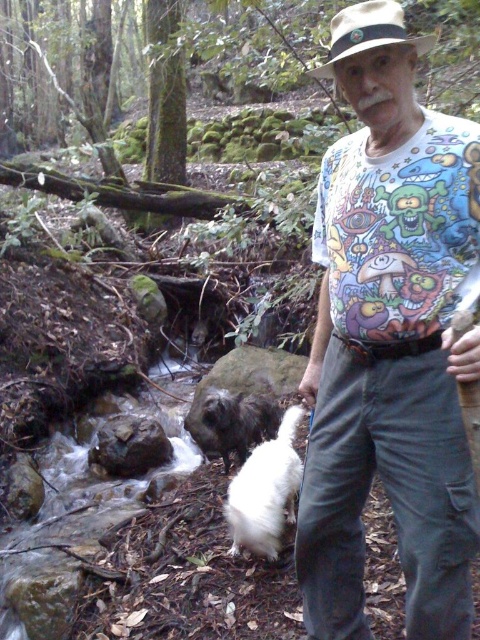
Can you confirm if white printed t-shirt at center is taller than beige fabric fedora at upper center?

Yes.

The height and width of the screenshot is (640, 480). What do you see at coordinates (389, 340) in the screenshot?
I see `white printed t-shirt at center` at bounding box center [389, 340].

Find the location of `white printed t-shirt at center`. white printed t-shirt at center is located at coordinates (389, 340).

Image resolution: width=480 pixels, height=640 pixels. Find the location of `white printed t-shirt at center`. white printed t-shirt at center is located at coordinates (389, 340).

Can you confirm if beige fabric fedora at upper center is positioned below shaggy black fur at center?

Incorrect, beige fabric fedora at upper center is not positioned below shaggy black fur at center.

Does beige fabric fedora at upper center have a lesser height compared to shaggy black fur at center?

Indeed, beige fabric fedora at upper center has a lesser height compared to shaggy black fur at center.

Between point (407, 38) and point (268, 433), which one is positioned in front?

Point (407, 38) is more forward.

In order to click on beige fabric fedora at upper center in this screenshot , I will do `click(368, 33)`.

Is white fluffy dog at center further to camera compared to shaggy black fur at center?

No, it is not.

Which is more to the left, white fluffy dog at center or shaggy black fur at center?

Positioned to the left is shaggy black fur at center.

Is point (262, 531) positioned in front of point (256, 444)?

Yes, it is.

You are a GUI agent. You are given a task and a screenshot of the screen. Output one action in this format:
    pyautogui.click(x=<x>, y=<y>)
    Task: Click on the white fluffy dog at center
    This screenshot has width=480, height=640.
    Given the screenshot: What is the action you would take?
    pyautogui.click(x=265, y=492)